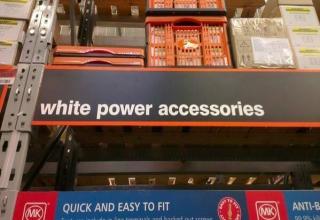
Image resolution: width=320 pixels, height=220 pixels. I want to click on orange metal trays, so click(123, 62), click(128, 52).